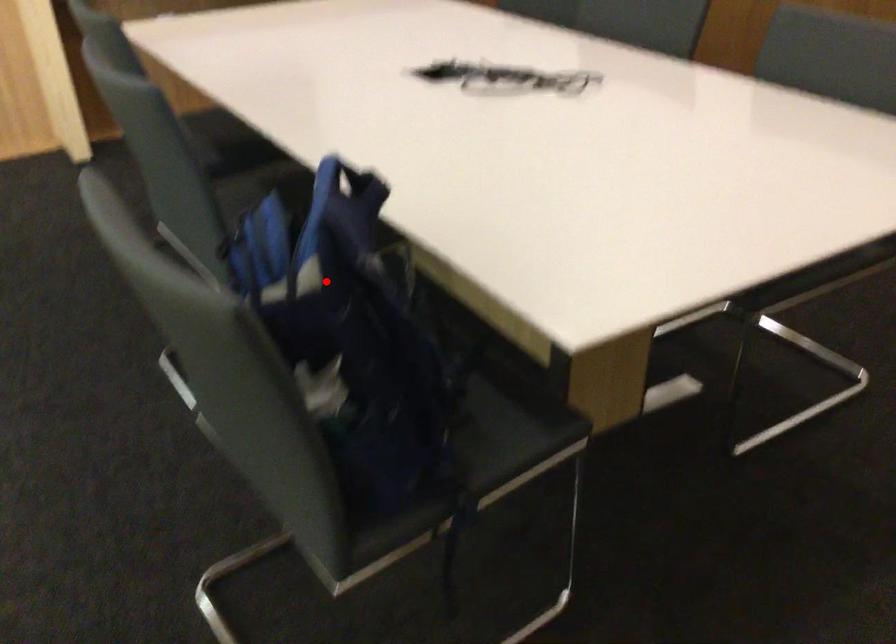
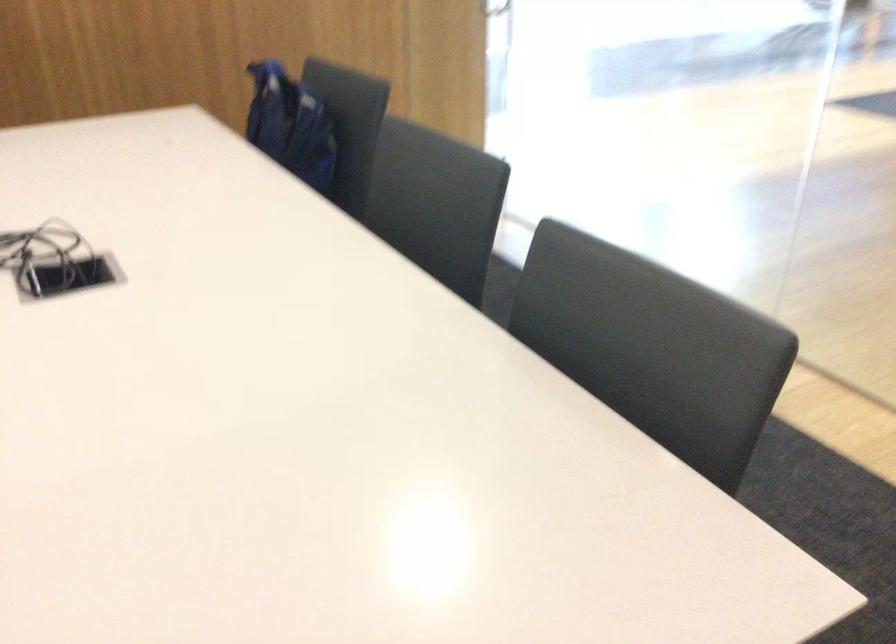
Locate, in the second image, the point that corresponds to the highlighted location in the first image.

(289, 125)